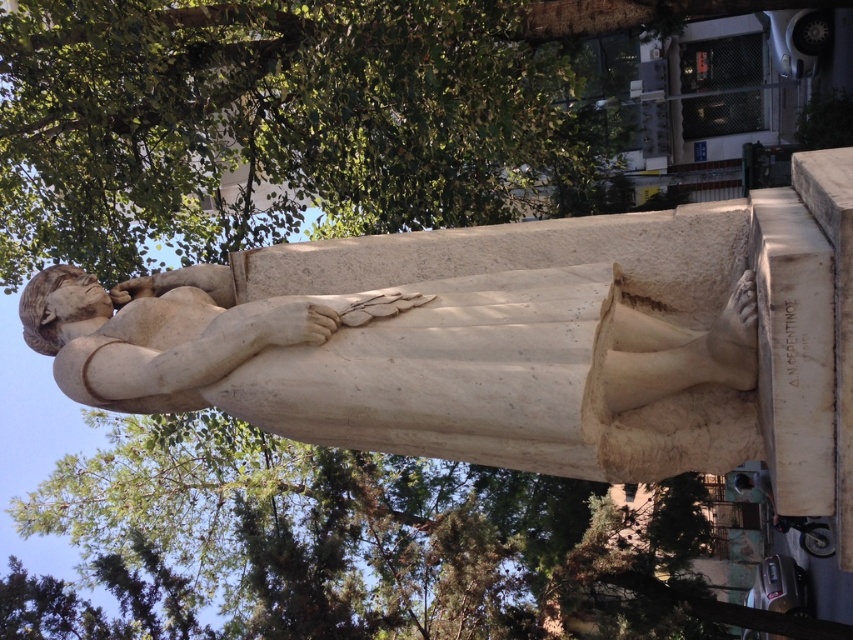
Question: Can you confirm if green leafy tree at upper center is positioned below white marble statue at center?

Choices:
 (A) yes
 (B) no

Answer: (B)

Question: Considering the relative positions of green leafy tree at upper center and white marble statue at center in the image provided, where is green leafy tree at upper center located with respect to white marble statue at center?

Choices:
 (A) above
 (B) below

Answer: (A)

Question: Observing the image, what is the correct spatial positioning of green leafy tree at upper center in reference to white marble statue at center?

Choices:
 (A) left
 (B) right

Answer: (A)

Question: Which of the following is the closest to the observer?

Choices:
 (A) white marble statue at center
 (B) green leafy tree at upper center

Answer: (A)

Question: Which object appears farthest from the camera in this image?

Choices:
 (A) green leafy tree at upper center
 (B) white marble statue at center

Answer: (A)